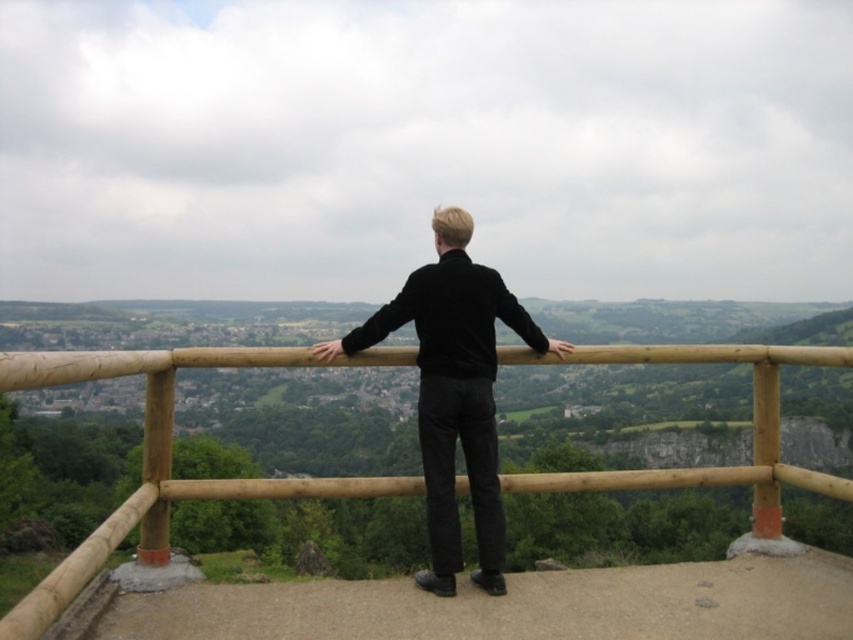
Question: Which object appears farthest from the camera in this image?

Choices:
 (A) black velvet sweater at center
 (B) brown wooden rail at center

Answer: (A)

Question: Which point is farther to the camera?

Choices:
 (A) (436, 433)
 (B) (564, 490)

Answer: (B)

Question: Does brown wooden rail at center have a larger size compared to black velvet sweater at center?

Choices:
 (A) no
 (B) yes

Answer: (B)

Question: Can you confirm if brown wooden rail at center is positioned above black velvet sweater at center?

Choices:
 (A) no
 (B) yes

Answer: (A)

Question: Is brown wooden rail at center further to the viewer compared to black velvet sweater at center?

Choices:
 (A) no
 (B) yes

Answer: (A)